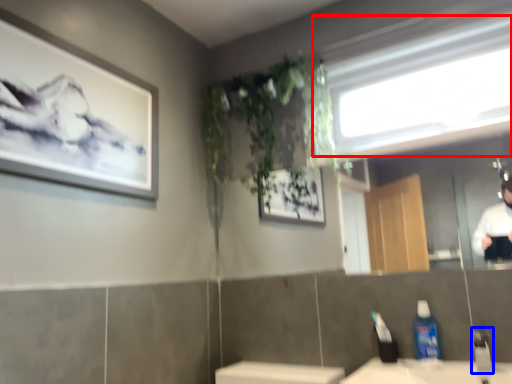
Question: Which object appears farthest to the camera in this image, window (highlighted by a red box) or faucet (highlighted by a blue box)?

Choices:
 (A) window
 (B) faucet

Answer: (A)